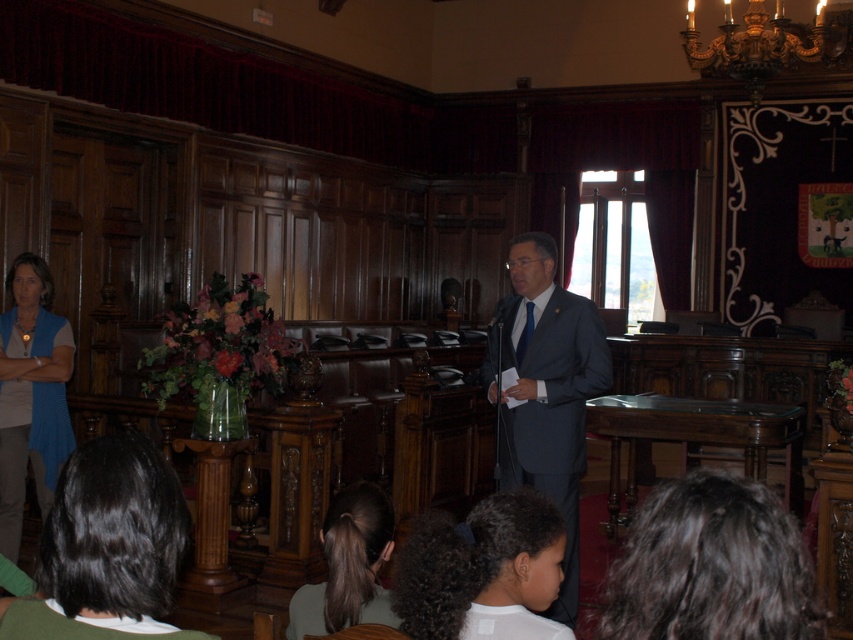
Question: Considering the real-world distances, which object is farthest from the dark brown hair at lower right?

Choices:
 (A) dark blue suit at center
 (B) dark brown hair at lower center
 (C) blue knitted vest at lower left

Answer: (C)

Question: Is dark brown hair at lower right smaller than dark curly hair at lower center?

Choices:
 (A) no
 (B) yes

Answer: (A)

Question: Does dark brown hair at lower right appear on the left side of dark brown hair at lower center?

Choices:
 (A) yes
 (B) no

Answer: (B)

Question: Which of the following is the farthest from the observer?

Choices:
 (A) dark curly hair at lower center
 (B) dark brown hair at lower right
 (C) dark brown hair at lower center

Answer: (C)

Question: From the image, what is the correct spatial relationship of dark brown hair at lower right in relation to dark brown hair at lower center?

Choices:
 (A) left
 (B) right

Answer: (B)

Question: Among these objects, which one is nearest to the camera?

Choices:
 (A) dark blue suit at center
 (B) dark brown hair at lower center
 (C) blue knitted vest at lower left
 (D) dark curly hair at lower center

Answer: (D)